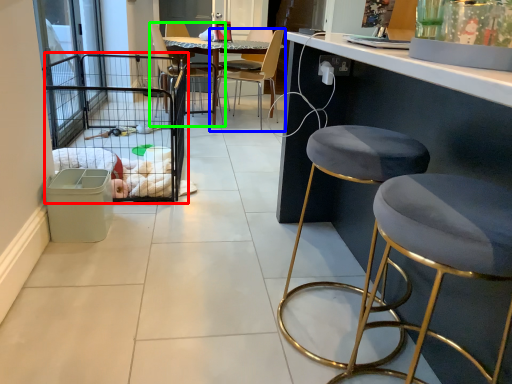
Question: Based on their relative distances, which object is farther from cage (highlighted by a red box)? Choose from chair (highlighted by a blue box) and chair (highlighted by a green box).

Choices:
 (A) chair
 (B) chair

Answer: (A)